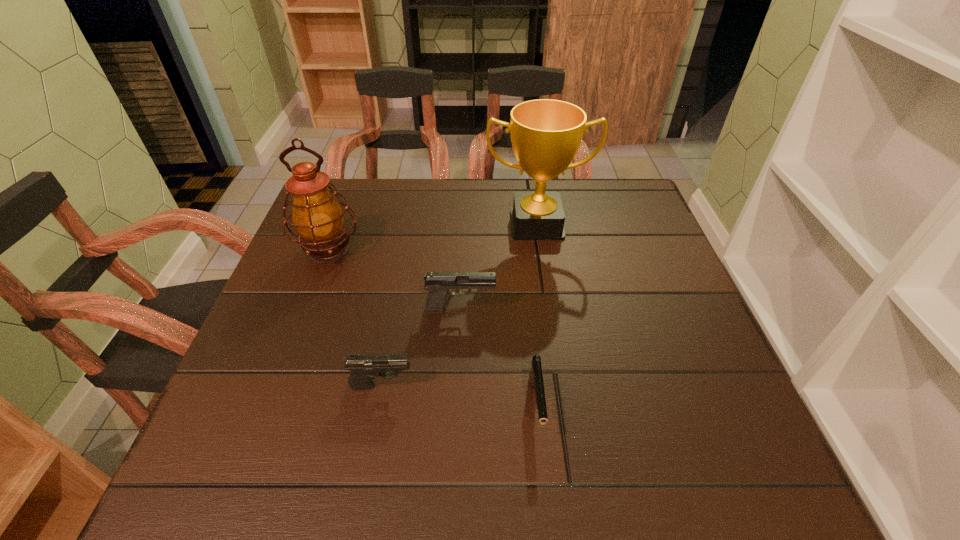
Locate an element on the screen. award is located at coordinates (546, 134).

You are a GUI agent. You are given a task and a screenshot of the screen. Output one action in this format:
    pyautogui.click(x=<x>, y=<y>)
    Task: Click on the leftmost object
    The height and width of the screenshot is (540, 960).
    Given the screenshot: What is the action you would take?
    pyautogui.click(x=318, y=218)

You are a GUI agent. You are given a task and a screenshot of the screen. Output one action in this format:
    pyautogui.click(x=<x>, y=<y>)
    Task: Click on the third farthest object
    The width and height of the screenshot is (960, 540).
    Given the screenshot: What is the action you would take?
    pyautogui.click(x=438, y=284)

The width and height of the screenshot is (960, 540). Identify the location of the farthest pistol. (438, 284).

I want to click on the leftmost pistol, so click(x=364, y=368).

Where is `the rightmost pistol`? This screenshot has width=960, height=540. the rightmost pistol is located at coordinates (535, 377).

The height and width of the screenshot is (540, 960). Identify the location of vacant region located on the front-facing side of the award. (544, 273).

Locate an element on the screen. The height and width of the screenshot is (540, 960). vacant space located 0.350m on the right of the oil lamp is located at coordinates (500, 251).

Locate an element on the screen. This screenshot has height=540, width=960. free spot located aim along the barrel of the third farthest object is located at coordinates (563, 309).

Find the location of a particular element. blank space located 0.130m at the barrel of the fourth object from right to left is located at coordinates (482, 385).